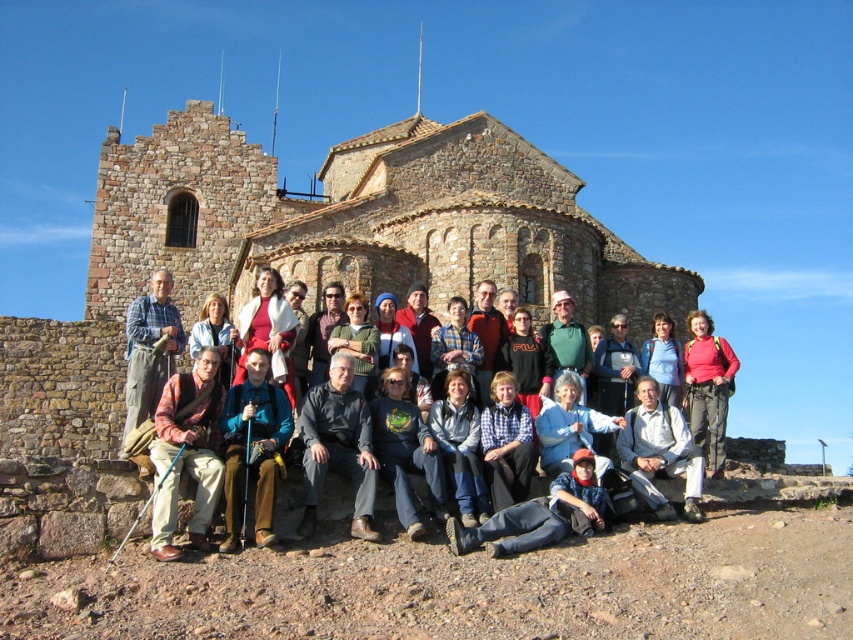
Is plaid fabric shirt at center smaller than blue plaid shirt at center?

Yes, plaid fabric shirt at center is smaller than blue plaid shirt at center.

Describe the element at coordinates (186, 452) in the screenshot. Image resolution: width=853 pixels, height=640 pixels. I see `plaid fabric shirt at center` at that location.

Between point (157, 426) and point (161, 300), which one is positioned behind?

The point (161, 300) is behind.

Locate an element on the screen. plaid fabric shirt at center is located at coordinates (186, 452).

Does blue denim jacket at center appear on the left side of dark gray fabric jacket at center?

Indeed, blue denim jacket at center is positioned on the left side of dark gray fabric jacket at center.

Which of these two, blue denim jacket at center or dark gray fabric jacket at center, stands taller?

With more height is blue denim jacket at center.

Measure the distance between point (260, 292) and camera.

Point (260, 292) and camera are 40.79 meters apart from each other.

This screenshot has height=640, width=853. What are the coordinates of `blue denim jacket at center` in the screenshot? It's located at (260, 337).

The height and width of the screenshot is (640, 853). What do you see at coordinates (260, 337) in the screenshot?
I see `blue denim jacket at center` at bounding box center [260, 337].

Between point (279, 444) and point (193, 440), which one is positioned behind?

Point (279, 444)

You are a GUI agent. You are given a task and a screenshot of the screen. Output one action in this format:
    pyautogui.click(x=<x>, y=<y>)
    Task: Click on the blue denim jacket at center
    The width and height of the screenshot is (853, 640).
    Given the screenshot: What is the action you would take?
    pyautogui.click(x=260, y=337)